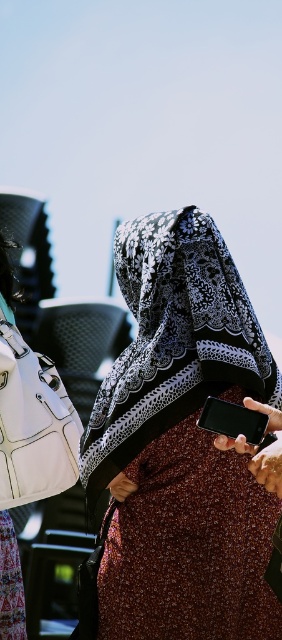
Question: Based on their relative distances, which object is farther from the black glossy smartphone at lower right?

Choices:
 (A) brown textured dress at center
 (B) patterned fabric headscarf at center

Answer: (A)

Question: Considering the relative positions of brown textured dress at center and black glossy smartphone at lower right in the image provided, where is brown textured dress at center located with respect to black glossy smartphone at lower right?

Choices:
 (A) above
 (B) below

Answer: (B)

Question: Which object is positioned farthest from the brown textured dress at center?

Choices:
 (A) patterned fabric headscarf at center
 (B) black glossy smartphone at lower right

Answer: (B)

Question: Considering the real-world distances, which object is farthest from the patterned fabric headscarf at center?

Choices:
 (A) black glossy smartphone at lower right
 (B) brown textured dress at center

Answer: (A)

Question: Is patterned fabric headscarf at center bigger than brown textured dress at center?

Choices:
 (A) no
 (B) yes

Answer: (B)

Question: Does patterned fabric headscarf at center appear on the left side of black glossy smartphone at lower right?

Choices:
 (A) no
 (B) yes

Answer: (B)